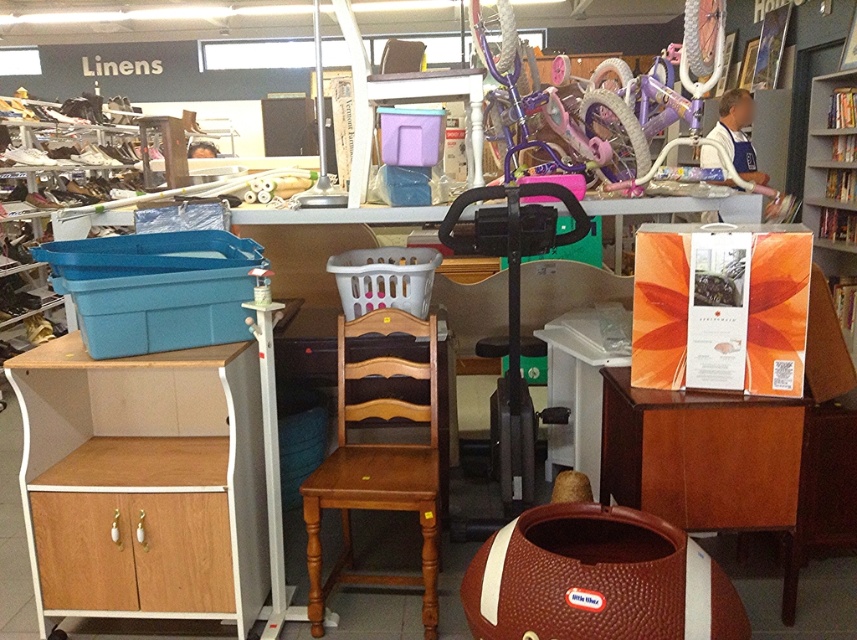
You are standing in the thrift store and want to reach an item located at point (322, 628) and another item at point (826, 109). Which item will you reach first if you move directly towards both?

You will reach the item at point (322, 628) first because it is closer to you than the item at point (826, 109).

You are organizing items in the thrift store and need to place a large box that requires more space than the light brown wood chair at center. Based on the scene, can the brown wood cabinet at lower right accommodate this box instead?

The brown wood cabinet at lower right has a larger width than the light brown wood chair at center, so it can accommodate the large box that requires more space.

You are a customer in a thrift store and want to pick up the light brown wood chair at center. To reach it, you must walk from the entrance which is near the brown wood cabinet at lower right. Is the chair closer to the entrance or further away?

The brown wood cabinet at lower right is closer to the viewer than light brown wood chair at center, so the chair is further away from the entrance.